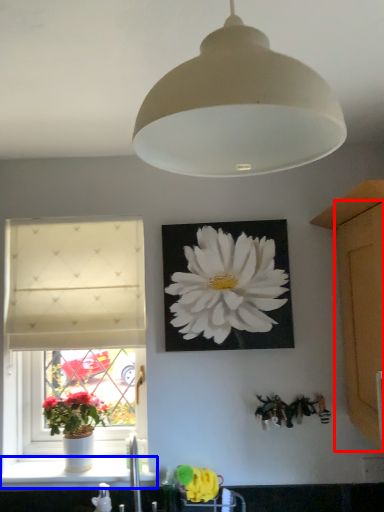
Question: Among these objects, which one is farthest to the camera, glass door (highlighted by a red box) or window sill (highlighted by a blue box)?

Choices:
 (A) glass door
 (B) window sill

Answer: (B)